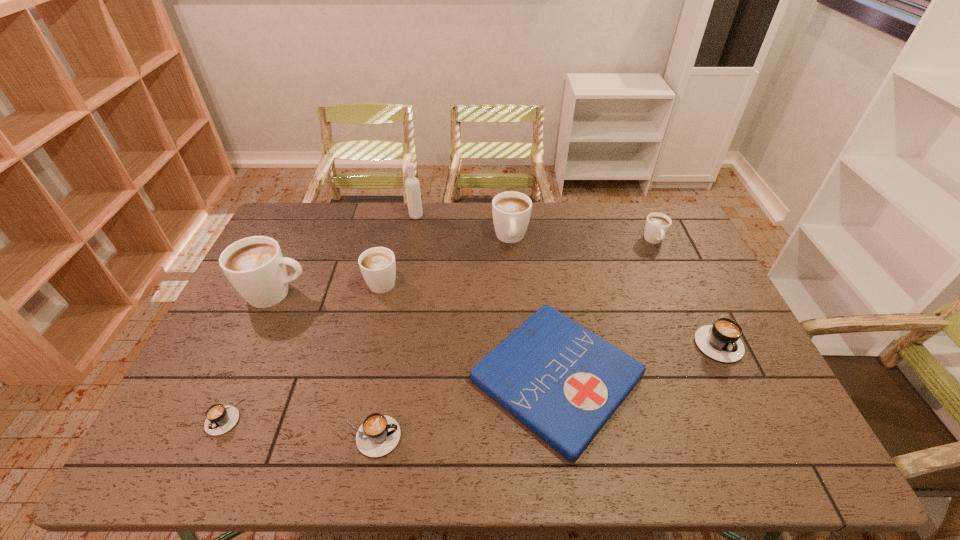
You are a GUI agent. You are given a task and a screenshot of the screen. Output one action in this format:
    pyautogui.click(x=<x>, y=<y>)
    Task: Click on the free spot between the third smallest white cappuccino and the smallest white cappuccino
    This screenshot has width=960, height=540.
    Given the screenshot: What is the action you would take?
    pyautogui.click(x=583, y=239)

Locate an element on the screen. object that can be found as the seventh closest to the third smallest white cappuccino is located at coordinates (379, 434).

Identify the location of object that stands as the third closest to the farthest black cappuccino. Image resolution: width=960 pixels, height=540 pixels. (511, 210).

Locate which cappuccino ranks in proximity to the biggest white cappuccino. Please provide its 2D coordinates. Your answer should be formatted as a tuple, i.e. [(x, y)], where the tuple contains the x and y coordinates of a point satisfying the conditions above.

[(378, 266)]

Choose which cappuccino is the fifth nearest neighbor to the fifth cappuccino from left to right. Please provide its 2D coordinates. Your answer should be formatted as a tuple, i.e. [(x, y)], where the tuple contains the x and y coordinates of a point satisfying the conditions above.

[(379, 434)]

Select which white cappuccino is the second closest to the second black cappuccino from right to left. Please provide its 2D coordinates. Your answer should be formatted as a tuple, i.e. [(x, y)], where the tuple contains the x and y coordinates of a point satisfying the conditions above.

[(378, 266)]

Find the location of a particular element. The width and height of the screenshot is (960, 540). the third closest white cappuccino relative to the biggest black cappuccino is located at coordinates (378, 266).

Locate an element on the screen. black cappuccino identified as the closest to the first-aid kit is located at coordinates (379, 434).

Image resolution: width=960 pixels, height=540 pixels. In order to click on black cappuccino that stands as the third closest to the white vodka in this screenshot , I will do `click(721, 341)`.

Identify the location of free region that satisfies the following two spatial constraints: 1. with the handle on the side of the second smallest white cappuccino; 2. on the left side of the white vodka. This screenshot has height=540, width=960. pos(397,216).